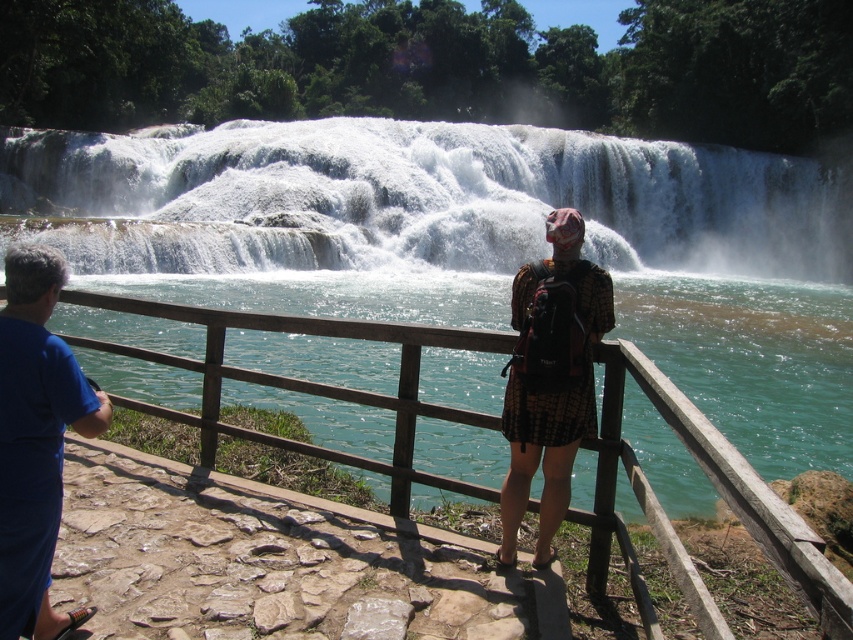
Question: Can you confirm if white frothy water at center is positioned above plaid fabric dress at center?

Choices:
 (A) yes
 (B) no

Answer: (A)

Question: Which point appears closest to the camera in this image?

Choices:
 (A) (566, 472)
 (B) (45, 467)
 (C) (387, 408)

Answer: (B)

Question: Is white frothy water at center below blue fabric shirt at lower left?

Choices:
 (A) yes
 (B) no

Answer: (B)

Question: Among these objects, which one is farthest from the camera?

Choices:
 (A) plaid fabric dress at center
 (B) white frothy water at center
 (C) brown wooden rail at center

Answer: (B)

Question: Is blue fabric shirt at lower left smaller than plaid fabric dress at center?

Choices:
 (A) no
 (B) yes

Answer: (A)

Question: Estimate the real-world distances between objects in this image. Which object is farther from the brown wooden rail at center?

Choices:
 (A) plaid fabric dress at center
 (B) blue fabric shirt at lower left
 (C) white frothy water at center

Answer: (C)